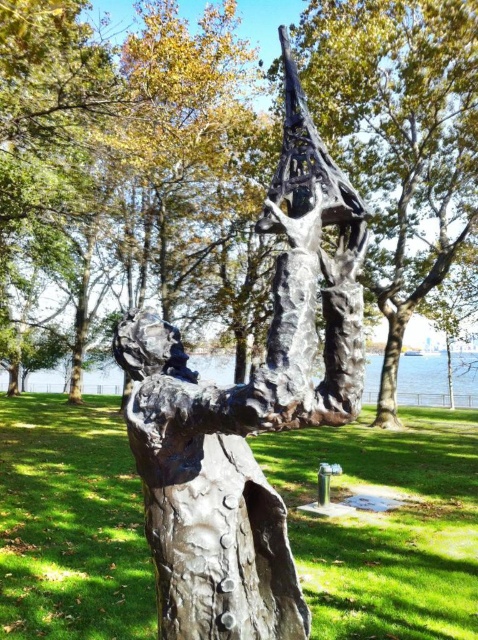
Which is below, shiny silver sculpture at center or smooth brown tree trunk at center?

Positioned lower is smooth brown tree trunk at center.

Looking at this image, does shiny silver sculpture at center come behind smooth brown tree trunk at center?

No, it is in front of smooth brown tree trunk at center.

Based on the photo, measure the distance between point (221, 54) and camera.

Point (221, 54) is 20.07 meters from camera.

Image resolution: width=478 pixels, height=640 pixels. Identify the location of shiny silver sculpture at center. (154, 177).

Is shiny silver sculpture at center taller than bronze sculpture at center?

Yes.

At what (x,y) coordinates should I click in order to perform the action: click on shiny silver sculpture at center. Please return your answer as a coordinate pair (x, y). Image resolution: width=478 pixels, height=640 pixels. Looking at the image, I should click on (154, 177).

Is point (237, 189) more distant than point (352, 360)?

Yes, point (237, 189) is farther from viewer.

Locate an element on the screen. This screenshot has width=478, height=640. shiny silver sculpture at center is located at coordinates (154, 177).

Is green grass at center thinner than bronze sculpture at center?

No.

Between green grass at center and bronze sculpture at center, which one has more height?

bronze sculpture at center

At what (x,y) coordinates should I click in order to perform the action: click on green grass at center. Please return your answer as a coordinate pair (x, y). The width and height of the screenshot is (478, 640). Looking at the image, I should click on (386, 525).

Locate an element on the screen. green grass at center is located at coordinates (386, 525).